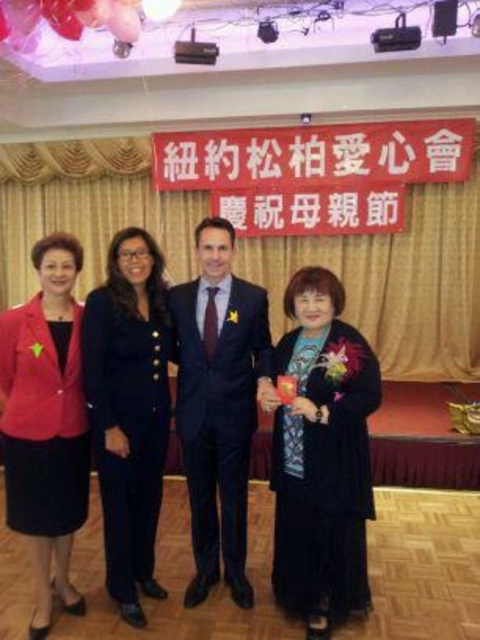
You are a photographer at the event and need to adjust the lighting so that both the dark blue suit at center and the matte red blazer at left are equally illuminated. Considering their heights, which one might require a higher light stand to achieve even lighting?

The dark blue suit at center is taller than the matte red blazer at left, so the higher light stand should be placed for the dark blue suit at center to ensure even illumination.